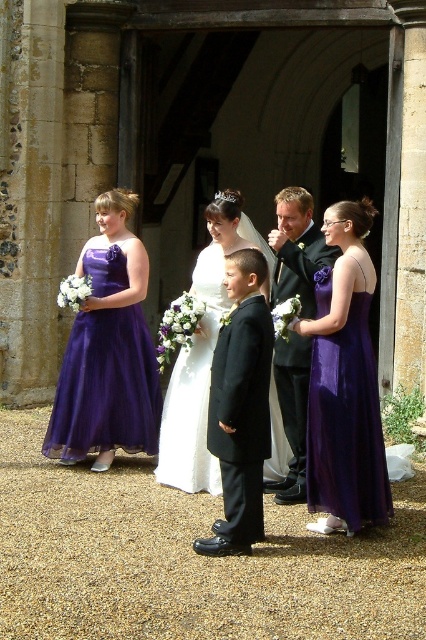
You are a photographer setting up for a wedding photo. You need to position a backdrop behind the matte purple dress at center and the shiny black suit at center. Which one requires more space to the left side of the backdrop?

The matte purple dress at center might require more space to the left side of the backdrop since it might be wider than the shiny black suit at center.